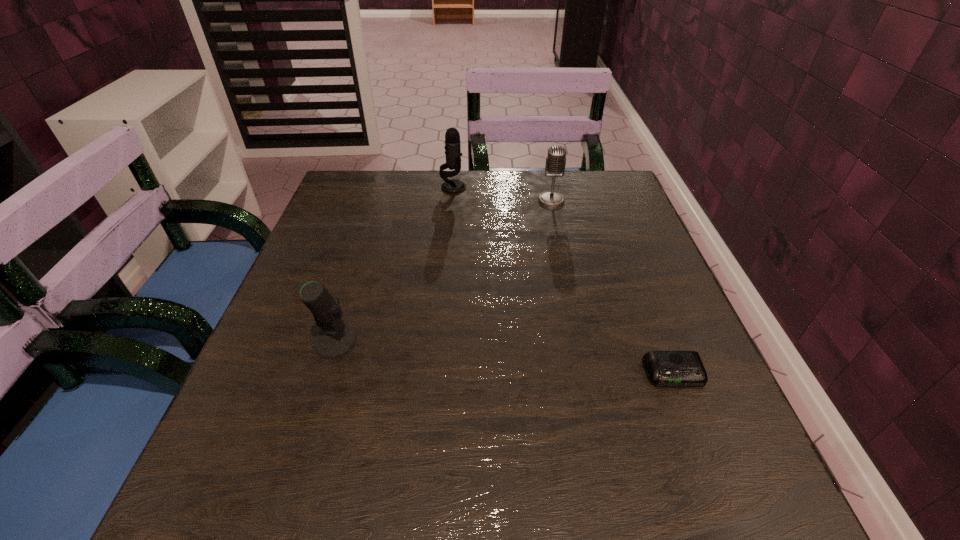
This screenshot has width=960, height=540. I want to click on free point between the second microphone from left to right and the second object from right to left, so click(502, 194).

Where is `vacant area that lies between the second microphone from right to left and the nearest object`? vacant area that lies between the second microphone from right to left and the nearest object is located at coordinates (564, 280).

Locate an element on the screen. vacant space that's between the shortest object and the second microphone from right to left is located at coordinates (564, 280).

The image size is (960, 540). Identify the location of empty space that is in between the third object from left to right and the second microphone from right to left. (502, 194).

This screenshot has width=960, height=540. Identify the location of vacant area that lies between the third object from left to right and the leftmost object. (444, 271).

This screenshot has height=540, width=960. What are the coordinates of `free space between the alarm clock and the second object from right to left` in the screenshot? It's located at (612, 287).

This screenshot has height=540, width=960. I want to click on free space between the shortest object and the third object from right to left, so click(564, 280).

At what (x,y) coordinates should I click in order to perform the action: click on object that stands as the closest to the second object from right to left. Please return your answer as a coordinate pair (x, y). Looking at the image, I should click on (453, 153).

I want to click on the third closest object to the rightmost object, so click(x=453, y=153).

Image resolution: width=960 pixels, height=540 pixels. I want to click on the closest microphone to the nearest object, so coord(555,164).